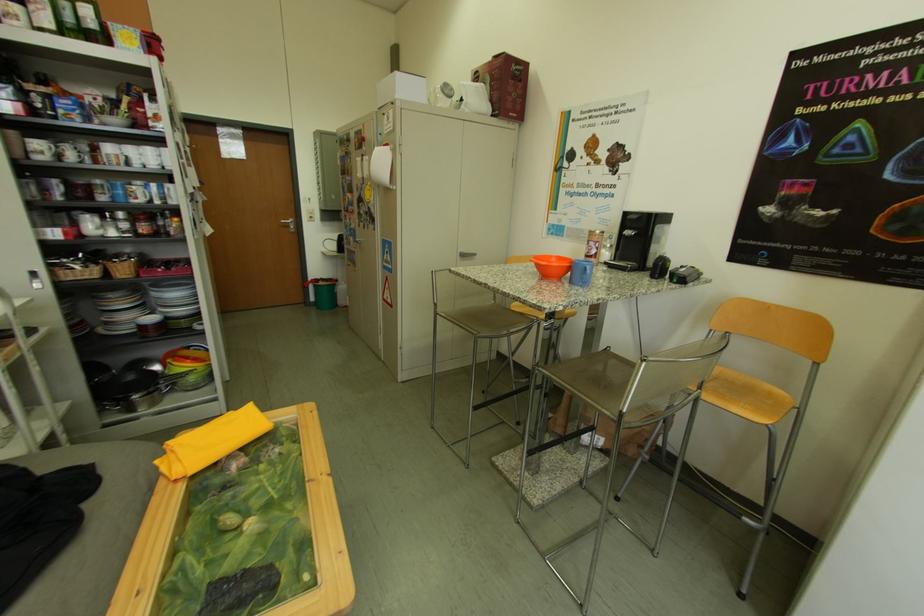
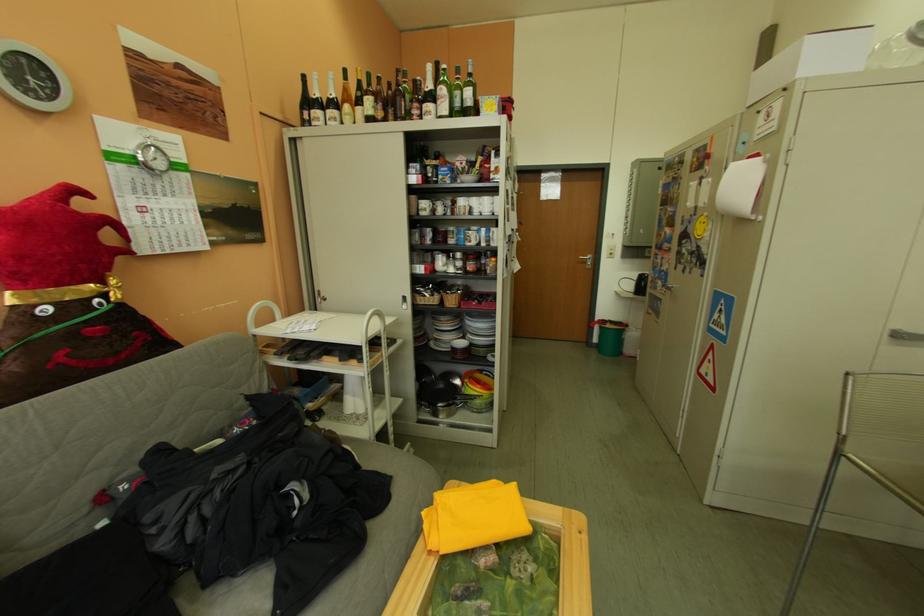
Find the pixel in the second image that matches point 136,161 in the first image.

(481, 211)